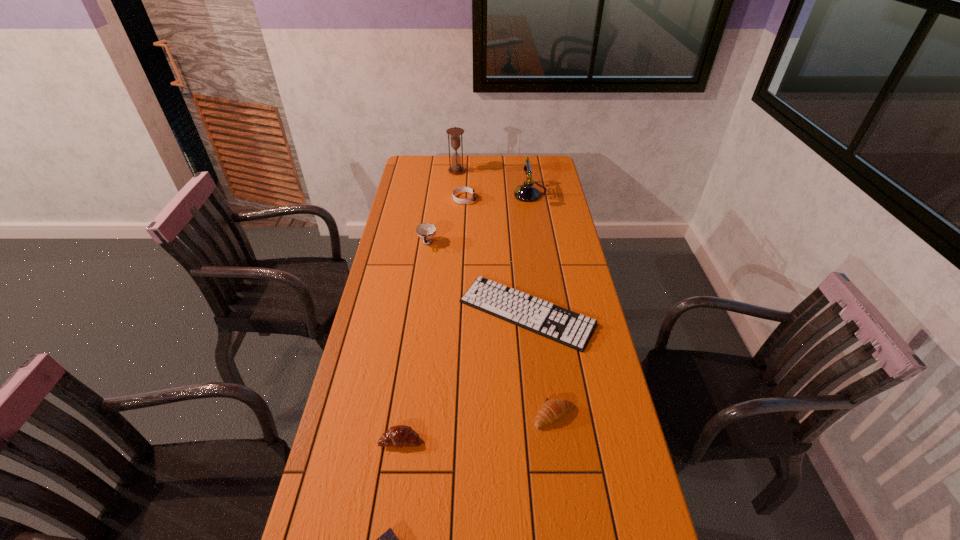
This screenshot has height=540, width=960. What are the coordinates of `crescent roll present at the left edge` in the screenshot? It's located at (397, 436).

Locate an element on the screen. The image size is (960, 540). telephone that is at the right edge is located at coordinates (527, 192).

Where is `crescent roll that is at the right edge`? The image size is (960, 540). crescent roll that is at the right edge is located at coordinates (552, 409).

Identify the location of computer keyboard located in the right edge section of the desktop. (556, 323).

Image resolution: width=960 pixels, height=540 pixels. I want to click on free location at the far edge, so click(x=502, y=164).

In the image, there is a desktop. What are the coordinates of `vacant space at the left edge` in the screenshot? It's located at (379, 450).

Where is `vacant region at the right edge of the desktop`? vacant region at the right edge of the desktop is located at coordinates (561, 188).

Where is `free spot between the wristband and the third tallest object`? The height and width of the screenshot is (540, 960). free spot between the wristband and the third tallest object is located at coordinates (445, 221).

In order to click on vacant area between the third tallest object and the wristband in this screenshot , I will do click(445, 221).

The width and height of the screenshot is (960, 540). I want to click on free spot between the tallest object and the third tallest object, so click(x=442, y=207).